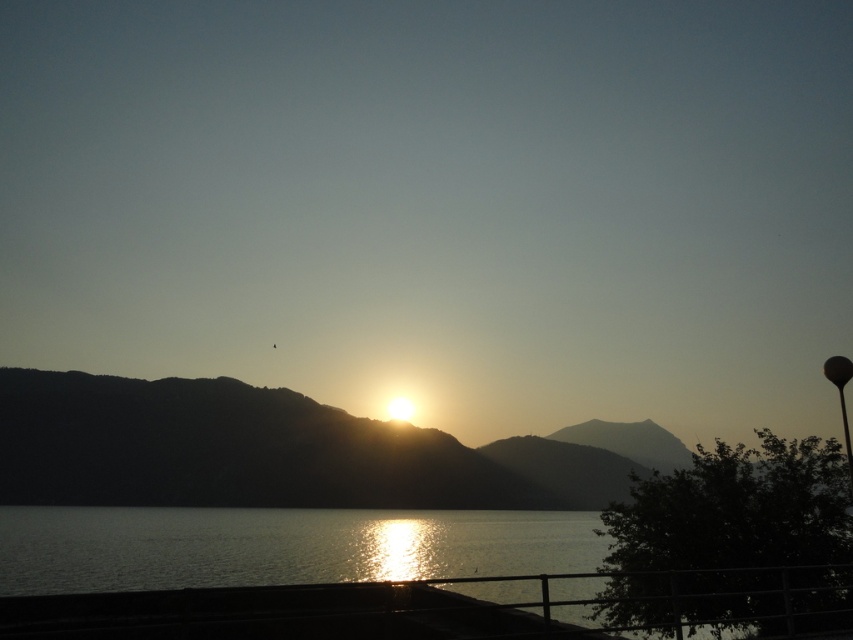
Question: Which object is closer to the camera taking this photo?

Choices:
 (A) silvery metallic mountain at center
 (B) glistening water at lower center

Answer: (B)

Question: Does silvery metallic mountain at center have a smaller size compared to glistening water at lower center?

Choices:
 (A) no
 (B) yes

Answer: (A)

Question: Does silvery metallic mountain at center lie in front of glistening water at lower center?

Choices:
 (A) yes
 (B) no

Answer: (B)

Question: Which point is farther to the camera?

Choices:
 (A) (581, 557)
 (B) (595, 486)

Answer: (B)

Question: Is silvery metallic mountain at center below glistening water at lower center?

Choices:
 (A) yes
 (B) no

Answer: (A)

Question: Which point is closer to the camera taking this photo?

Choices:
 (A) (343, 506)
 (B) (175, 566)

Answer: (B)